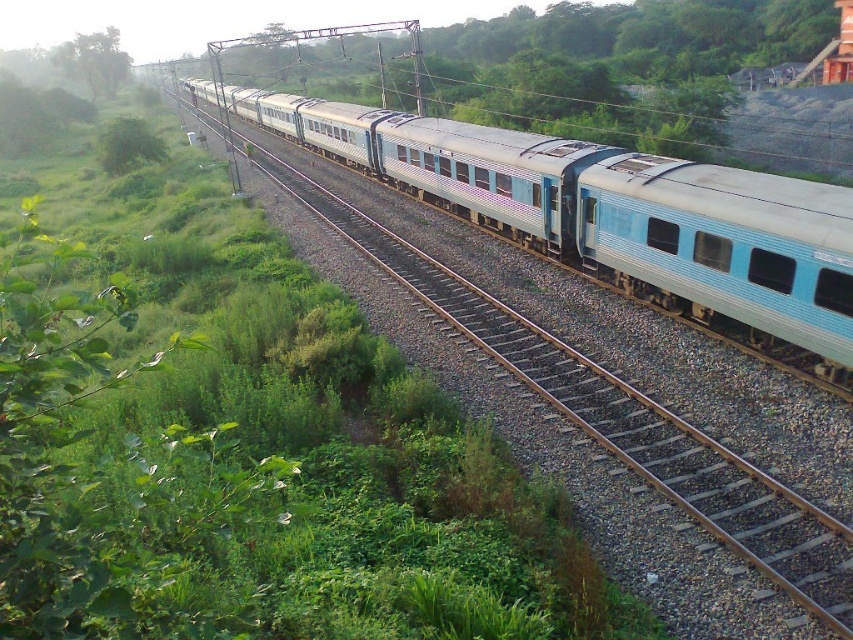
Question: Among these objects, which one is nearest to the camera?

Choices:
 (A) light blue metal train at center
 (B) green leafy tree at upper left

Answer: (A)

Question: Which point is farther to the camera?

Choices:
 (A) green leafy tree at upper left
 (B) light blue metal train at center

Answer: (A)

Question: Where is light blue metal train at center located in relation to green leafy tree at upper left in the image?

Choices:
 (A) above
 (B) below

Answer: (B)

Question: Can you confirm if light blue metal train at center is wider than green leafy tree at upper left?

Choices:
 (A) yes
 (B) no

Answer: (A)

Question: Is light blue metal train at center in front of green leafy tree at upper left?

Choices:
 (A) yes
 (B) no

Answer: (A)

Question: Which point is closer to the camera taking this photo?

Choices:
 (A) (640, 205)
 (B) (125, 68)

Answer: (A)